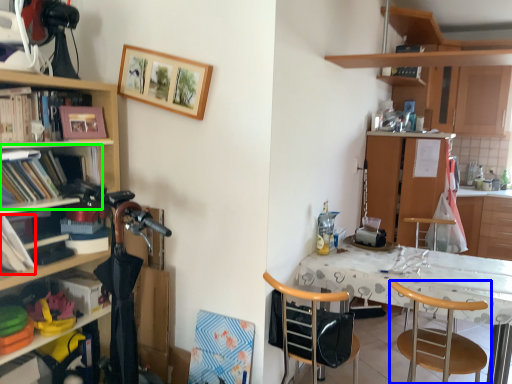
Question: Which object is the farthest from book (highlighted by a red box)? Choose among these: chair (highlighted by a blue box) or shelf (highlighted by a green box).

Choices:
 (A) chair
 (B) shelf

Answer: (A)